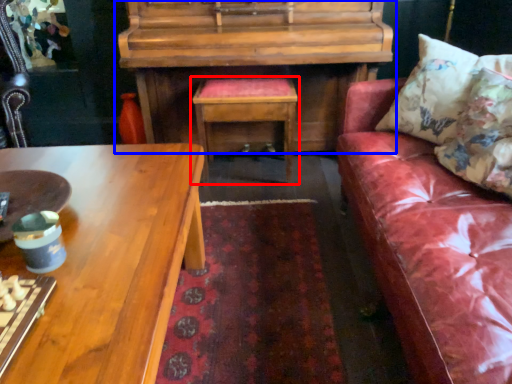
Question: Which point is closer to the camera, table (highlighted by a red box) or piano (highlighted by a blue box)?

Choices:
 (A) table
 (B) piano

Answer: (B)